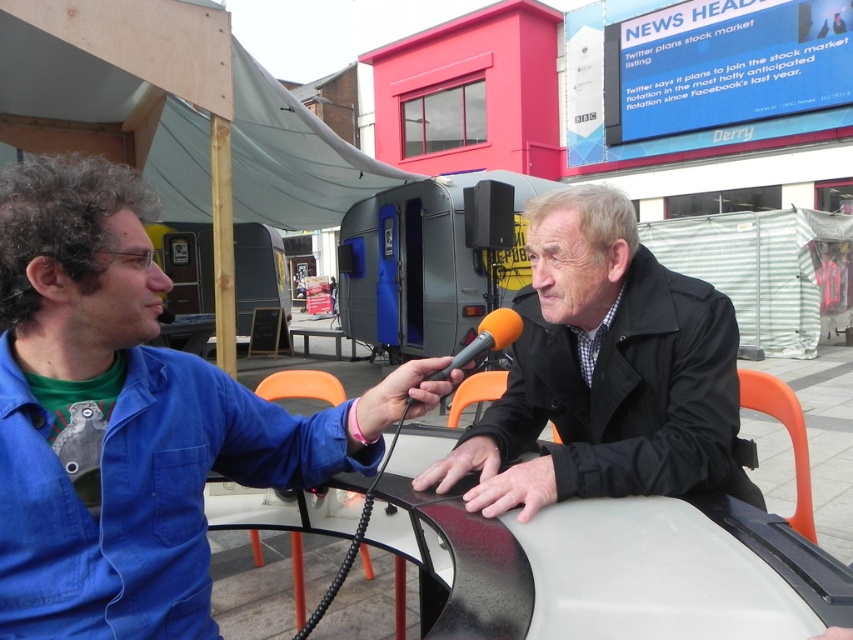
Question: Which object appears farthest from the camera in this image?

Choices:
 (A) blue cotton shirt at left
 (B) orange matte microphone at center

Answer: (B)

Question: Does blue cotton shirt at left appear on the right side of orange matte microphone at center?

Choices:
 (A) yes
 (B) no

Answer: (B)

Question: Is blue cotton shirt at left closer to camera compared to orange matte microphone at center?

Choices:
 (A) no
 (B) yes

Answer: (B)

Question: Which of the following is the farthest from the observer?

Choices:
 (A) orange matte microphone at center
 (B) blue cotton shirt at left
 (C) black matte jacket at center

Answer: (A)

Question: Where is blue cotton shirt at left located in relation to black matte jacket at center in the image?

Choices:
 (A) above
 (B) below

Answer: (A)

Question: Considering the real-world distances, which object is farthest from the orange matte microphone at center?

Choices:
 (A) blue cotton shirt at left
 (B) black matte jacket at center

Answer: (A)